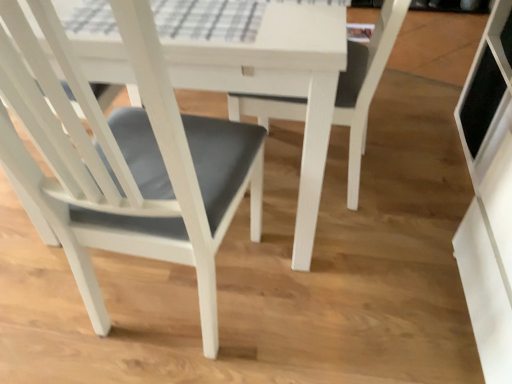
Question: From the image's perspective, is matte gray cushion at center, which is counted as the 1th chair, starting from the right, above or below matte gray cushion at center, positioned as the first chair in left-to-right order?

Choices:
 (A) above
 (B) below

Answer: (B)

Question: Looking at their shapes, would you say matte gray cushion at center, positioned as the 2th chair in left-to-right order, is wider or thinner than matte gray cushion at center, placed as the second chair when sorted from right to left?

Choices:
 (A) wide
 (B) thin

Answer: (B)

Question: From their relative heights in the image, would you say matte gray cushion at center, positioned as the 2th chair in left-to-right order, is taller or shorter than matte gray cushion at center, positioned as the first chair in left-to-right order?

Choices:
 (A) tall
 (B) short

Answer: (A)

Question: Considering the positions of point (103, 124) and point (352, 205), is point (103, 124) closer or farther from the camera than point (352, 205)?

Choices:
 (A) farther
 (B) closer

Answer: (B)

Question: From the image's perspective, is matte gray cushion at center, positioned as the first chair in left-to-right order, above or below matte gray cushion at center, positioned as the 2th chair in left-to-right order?

Choices:
 (A) above
 (B) below

Answer: (A)

Question: Is matte gray cushion at center, positioned as the first chair in left-to-right order, to the left or to the right of matte gray cushion at center, positioned as the 2th chair in left-to-right order, in the image?

Choices:
 (A) right
 (B) left

Answer: (B)

Question: Is matte gray cushion at center, placed as the second chair when sorted from right to left, spatially inside matte gray cushion at center, positioned as the 2th chair in left-to-right order, or outside of it?

Choices:
 (A) outside
 (B) inside

Answer: (A)